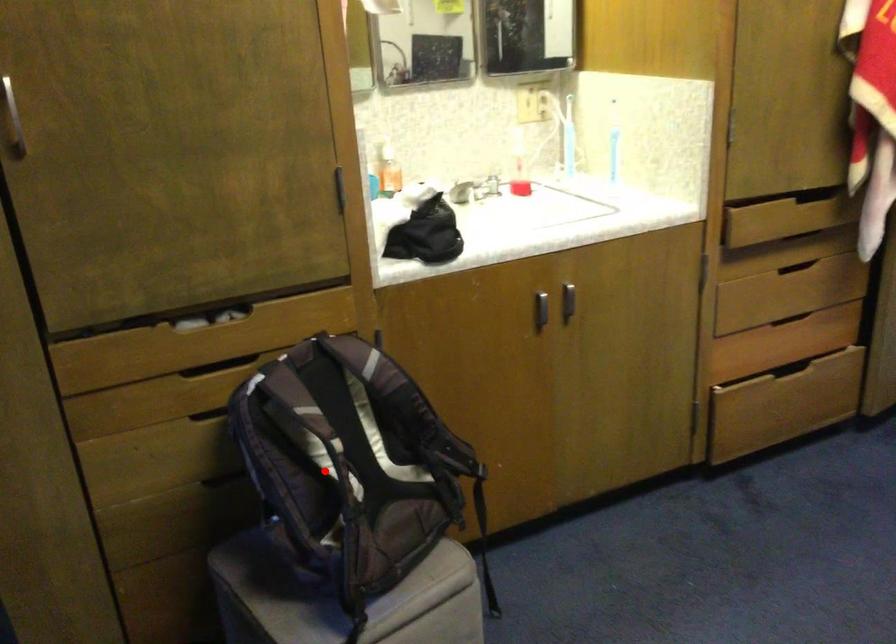
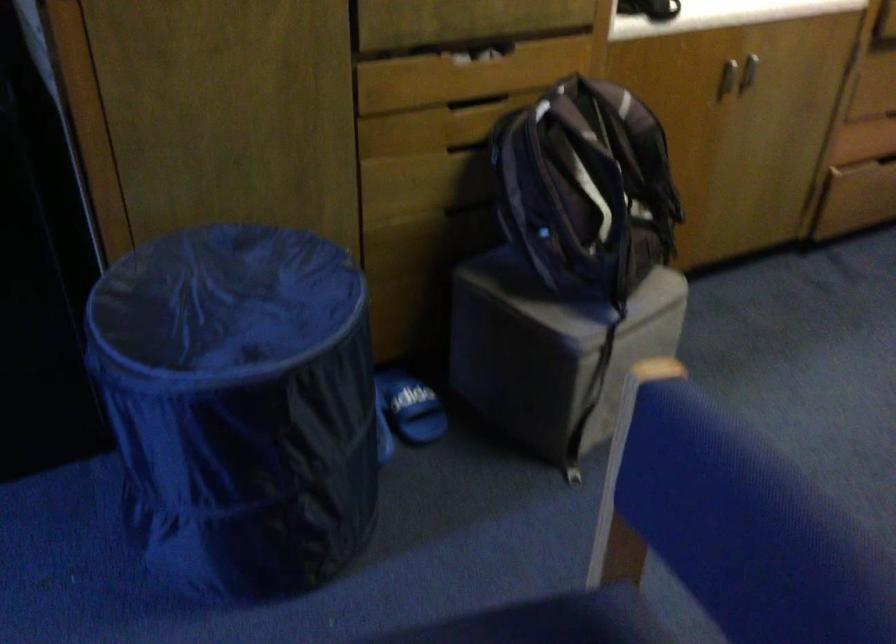
Question: I am providing you with two images of the same scene from different viewpoints. A red point is marked on the first image. Can you still see the location of the red point in image 2?

Choices:
 (A) Yes
 (B) No

Answer: (A)